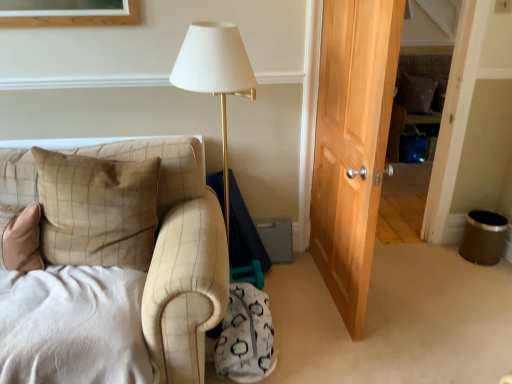
Question: In terms of width, does beige plaid pillow at left, the second pillow viewed from the top, look wider or thinner when compared to velvet brown pillow at upper right, the second pillow viewed from the left?

Choices:
 (A) thin
 (B) wide

Answer: (B)

Question: Considering the positions of beige plaid pillow at left, the 1th pillow from the front, and velvet brown pillow at upper right, acting as the 1th pillow starting from the back, in the image, is beige plaid pillow at left, the 1th pillow from the front, bigger or smaller than velvet brown pillow at upper right, acting as the 1th pillow starting from the back,?

Choices:
 (A) small
 (B) big

Answer: (B)

Question: Based on their positions, is beige plaid pillow at left, which is the first pillow from bottom to top, located to the left or right of velvet brown pillow at upper right, the first pillow when ordered from top to bottom?

Choices:
 (A) left
 (B) right

Answer: (A)

Question: From the image's perspective, is velvet brown pillow at upper right, placed as the first pillow when sorted from right to left, located above or below beige plaid pillow at left, which ranks as the 2th pillow in back-to-front order?

Choices:
 (A) above
 (B) below

Answer: (A)

Question: From their relative heights in the image, would you say velvet brown pillow at upper right, the second pillow viewed from the left, is taller or shorter than beige plaid pillow at left, positioned as the first pillow in left-to-right order?

Choices:
 (A) tall
 (B) short

Answer: (B)

Question: Based on their positions, is velvet brown pillow at upper right, placed as the first pillow when sorted from right to left, located to the left or right of beige plaid pillow at left, which is the first pillow from bottom to top?

Choices:
 (A) left
 (B) right

Answer: (B)

Question: From a real-world perspective, is velvet brown pillow at upper right, acting as the 1th pillow starting from the back, positioned above or below beige plaid pillow at left, which ranks as the 2th pillow in back-to-front order?

Choices:
 (A) below
 (B) above

Answer: (A)